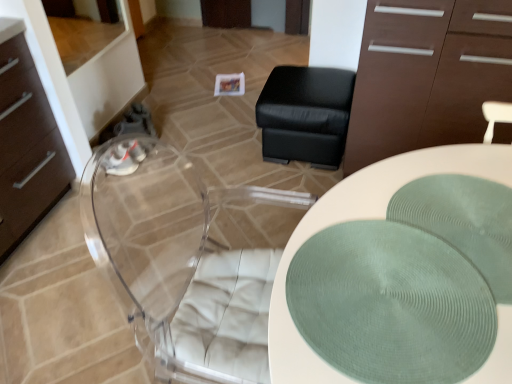
You are a GUI agent. You are given a task and a screenshot of the screen. Output one action in this format:
    pyautogui.click(x=<x>, y=<y>)
    Task: Click on the vacant space situated above black leather ottoman at center (from a real-world perspective)
    Image resolution: width=512 pixels, height=384 pixels.
    Given the screenshot: What is the action you would take?
    pyautogui.click(x=298, y=86)